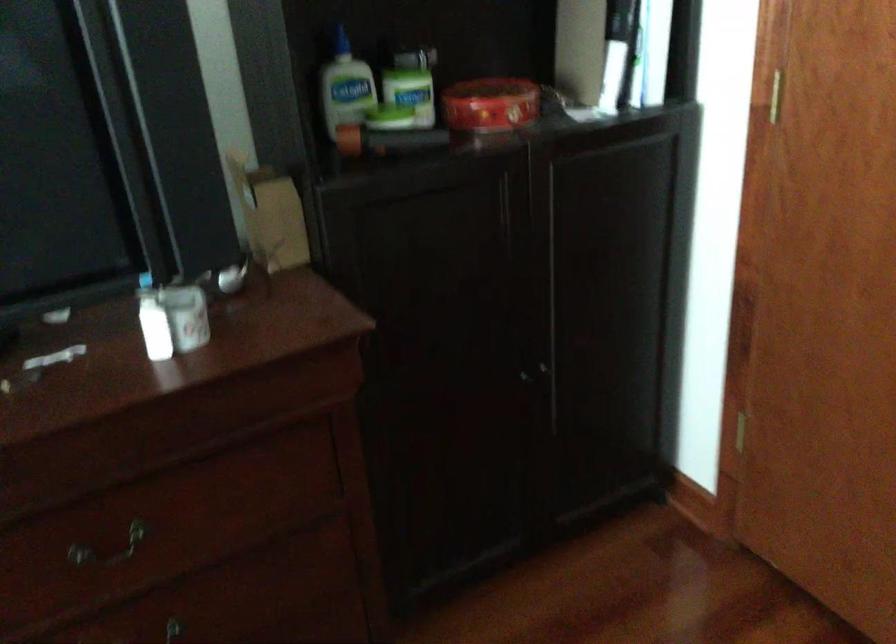
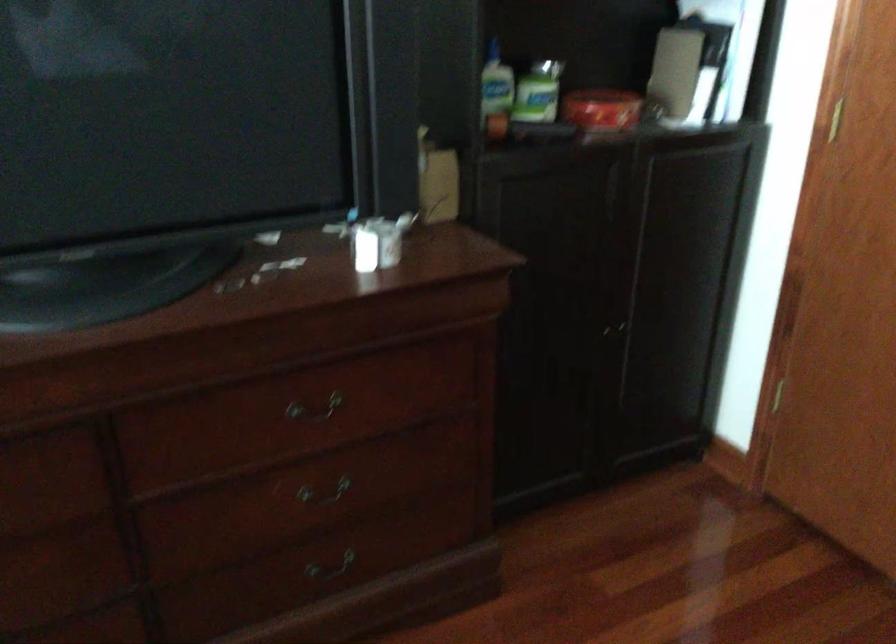
The point at (488,109) is marked in the first image. Where is the corresponding point in the second image?

(600, 109)